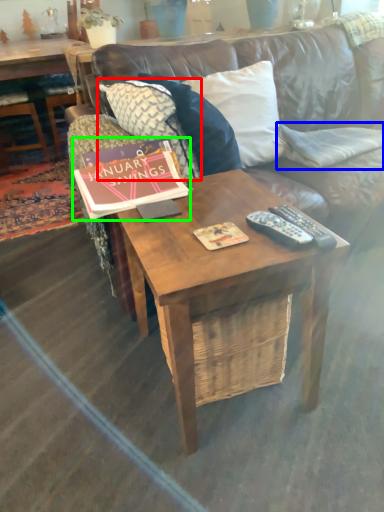
Question: Which object is the farthest from pillow (highlighted by a red box)? Choose among these: pillow (highlighted by a blue box) or book (highlighted by a green box).

Choices:
 (A) pillow
 (B) book

Answer: (A)